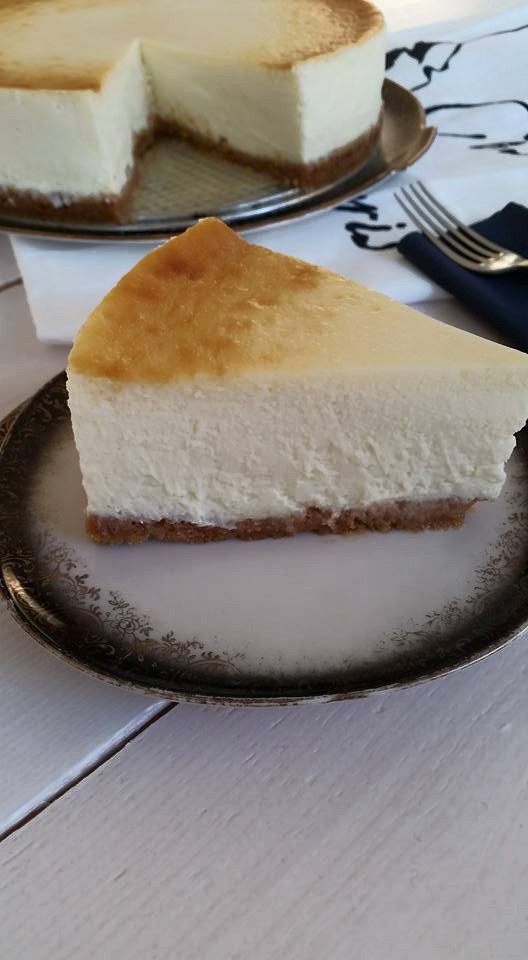
Locate an element on the screen. napkin is located at coordinates (491, 306).